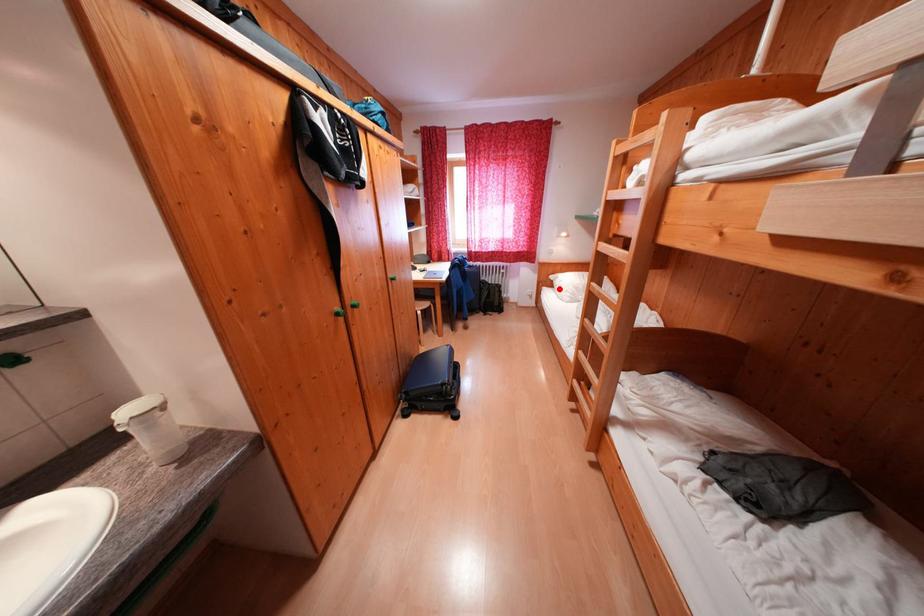
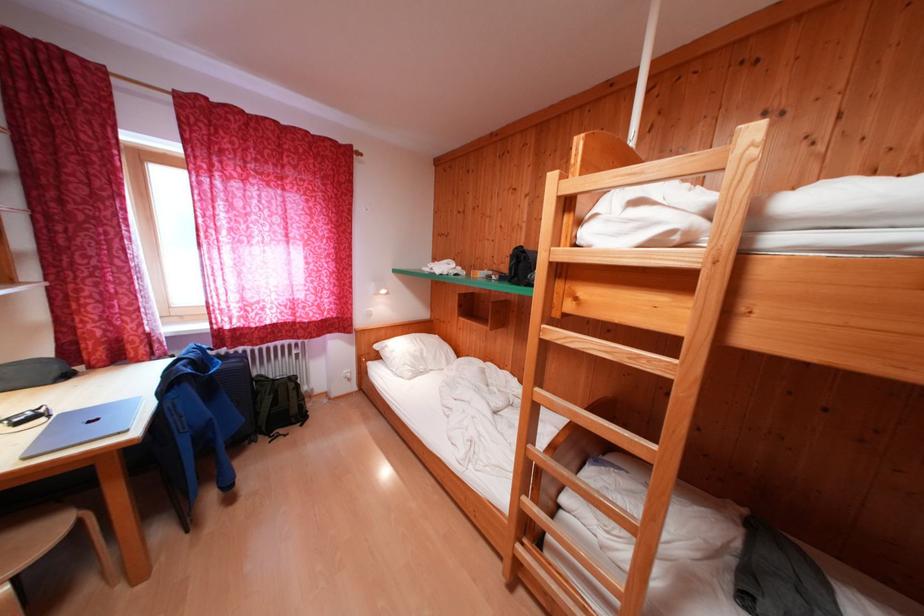
Question: I am providing you with two images of the same scene from different viewpoints. Given a red point in image1, look at the same physical point in image2. Is it:

Choices:
 (A) Closer to the viewpoint
 (B) Farther from the viewpoint

Answer: (B)